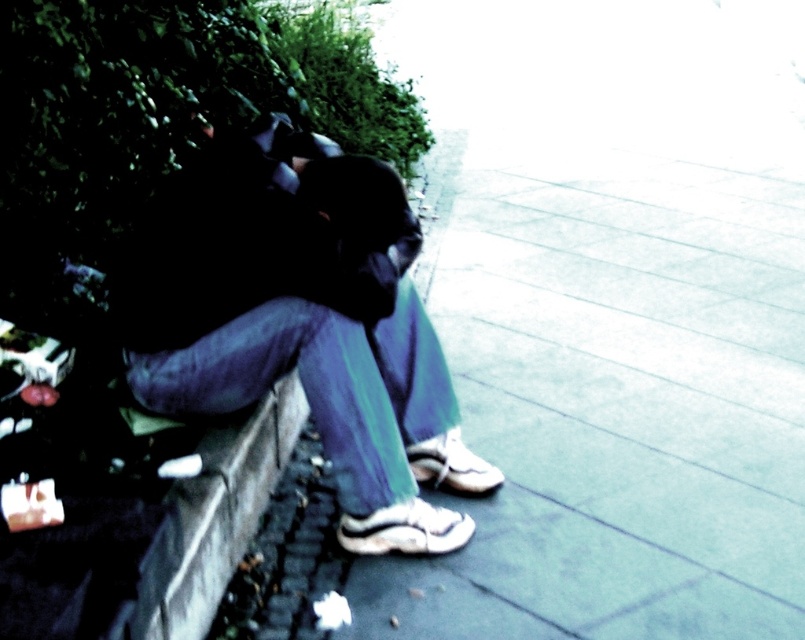
Can you confirm if smooth concrete pavement at center is bigger than matte black jacket at center?

Yes, smooth concrete pavement at center is bigger than matte black jacket at center.

Measure the distance between smooth concrete pavement at center and matte black jacket at center.

smooth concrete pavement at center and matte black jacket at center are 21.17 inches apart from each other.

Is point (688, 410) less distant than point (398, 472)?

No, it is behind (398, 472).

Locate an element on the screen. smooth concrete pavement at center is located at coordinates (612, 400).

Is matte black jacket at center above gray concrete curb at lower left?

Indeed, matte black jacket at center is positioned over gray concrete curb at lower left.

Image resolution: width=805 pixels, height=640 pixels. Describe the element at coordinates (304, 332) in the screenshot. I see `matte black jacket at center` at that location.

Which is in front, point (131, 348) or point (209, 516)?

Point (209, 516) is in front.

Locate an element on the screen. Image resolution: width=805 pixels, height=640 pixels. matte black jacket at center is located at coordinates (304, 332).

From the picture: Does smooth concrete pavement at center appear over gray concrete curb at lower left?

Yes.

Between smooth concrete pavement at center and gray concrete curb at lower left, which one appears on the left side from the viewer's perspective?

gray concrete curb at lower left

Between point (725, 173) and point (131, 612), which one is positioned behind?

Point (725, 173)

This screenshot has width=805, height=640. Identify the location of smooth concrete pavement at center. (612, 400).